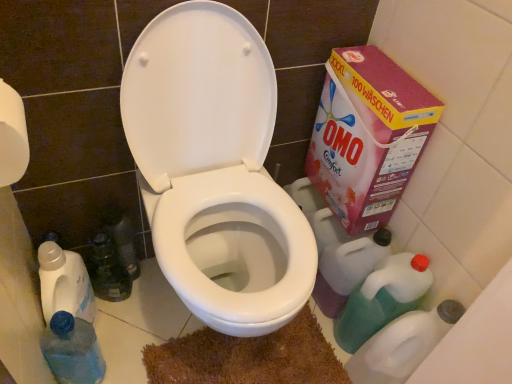
Question: From a real-world perspective, is white glossy toilet at center physically located above or below pink cardboard box at right?

Choices:
 (A) below
 (B) above

Answer: (A)

Question: Considering the positions of white glossy toilet at center and pink cardboard box at right in the image, is white glossy toilet at center bigger or smaller than pink cardboard box at right?

Choices:
 (A) small
 (B) big

Answer: (B)

Question: Which of these objects is positioned farthest from the green translucent bottle at lower right, arranged as the first cleaning product when viewed from the top?

Choices:
 (A) translucent plastic bottle at lower left
 (B) white glossy toilet at center
 (C) pink cardboard box at right
 (D) brown shaggy bath mat at center
 (E) translucent plastic bottle at lower right, marked as the first cleaning product in a bottom-to-top arrangement

Answer: (A)

Question: Estimate the real-world distances between objects in this image. Which object is farther from the translucent plastic bottle at lower right, placed as the 2th cleaning product when sorted from top to bottom?

Choices:
 (A) translucent plastic bottle at lower left
 (B) white glossy toilet at center
 (C) pink cardboard box at right
 (D) green translucent bottle at lower right, the second cleaning product ordered from the bottom
 (E) brown shaggy bath mat at center

Answer: (A)